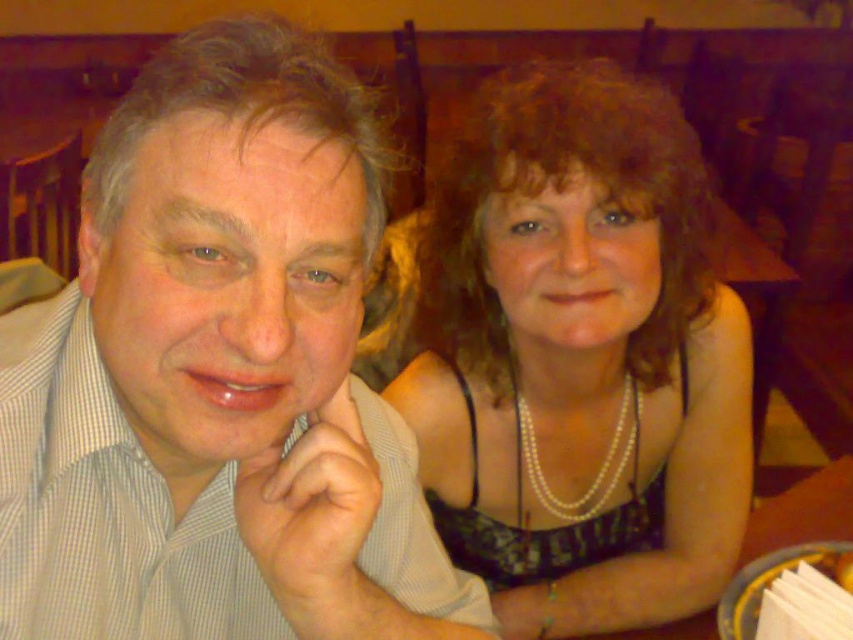
You are a waiter in a restaurant. You need to place a 40 cm wide menu between the white checkered shirt at left and the yellow glossy plate at lower right. Can you fit the menu between them without overlapping either?

The distance between the white checkered shirt at left and the yellow glossy plate at lower right is 56.95 centimeters. Since the menu is 40 cm wide, there is enough space to place it between them without overlapping either object.